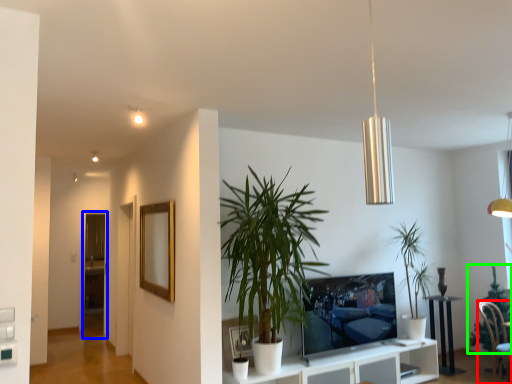
Question: Estimate the real-world distances between objects in this image. Which object is closer to chair (highlighted by a red box), glass door (highlighted by a blue box) or houseplant (highlighted by a green box)?

Choices:
 (A) glass door
 (B) houseplant

Answer: (B)